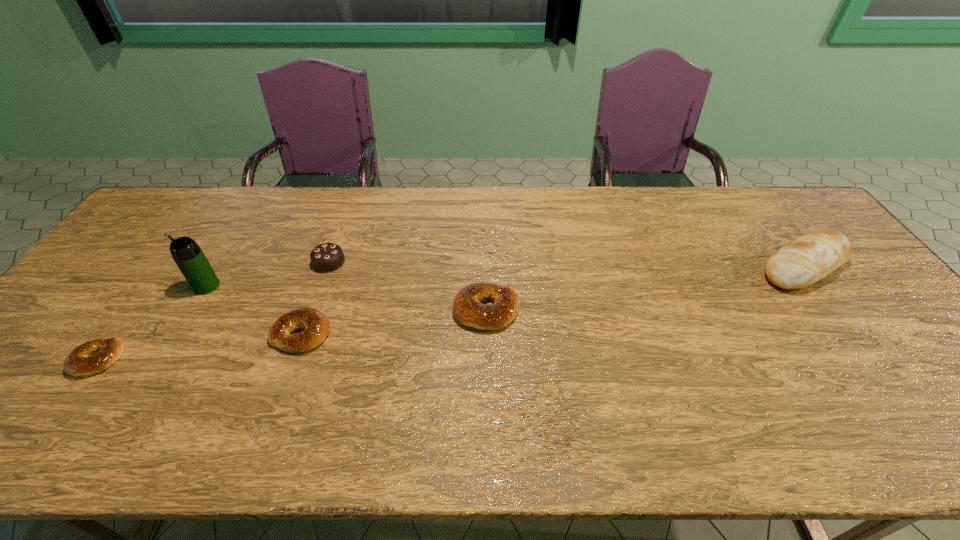
Locate an element on the screen. The height and width of the screenshot is (540, 960). vacant area that lies between the tallest object and the rightmost bagel is located at coordinates (347, 298).

Find the location of a particular element. The width and height of the screenshot is (960, 540). free space that is in between the leftmost bagel and the thermos bottle is located at coordinates (153, 322).

Locate an element on the screen. This screenshot has height=540, width=960. free spot between the fourth shortest object and the leftmost object is located at coordinates (213, 310).

Where is `empty location between the shortest bagel and the fourth shortest object`? empty location between the shortest bagel and the fourth shortest object is located at coordinates (213, 310).

What are the coordinates of `vacant area that lies between the fourth tallest object and the third tallest object` in the screenshot? It's located at (408, 286).

Find the location of a particular element. The image size is (960, 540). object that is the fifth closest to the tallest object is located at coordinates (809, 258).

The height and width of the screenshot is (540, 960). Find the location of `the fifth closest object to the fifth object from left to right`. the fifth closest object to the fifth object from left to right is located at coordinates (95, 356).

I want to click on bagel that is the closest one to the shortest object, so point(316,326).

Identify which bagel is the third closest to the chocolate cake. Please provide its 2D coordinates. Your answer should be formatted as a tuple, i.e. [(x, y)], where the tuple contains the x and y coordinates of a point satisfying the conditions above.

[(95, 356)]

This screenshot has height=540, width=960. What are the coordinates of `free location that satisfies the following two spatial constraints: 1. on the front side of the chocolate cake; 2. on the left side of the bread` in the screenshot? It's located at (327, 267).